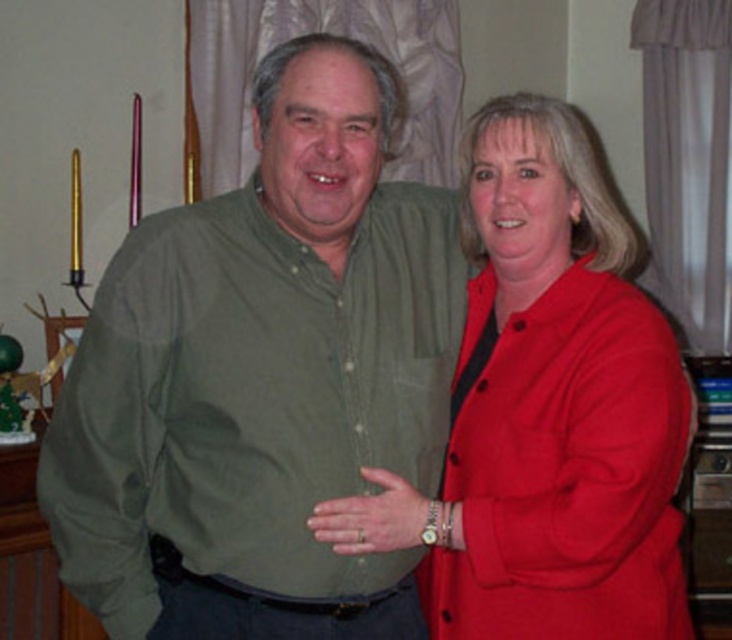
In the scene shown: Who is more distant from viewer, (326,68) or (507,138)?

The point (507,138) is more distant.

Does green cotton shirt at center have a smaller size compared to matte red blazer at center?

Indeed, green cotton shirt at center has a smaller size compared to matte red blazer at center.

Which is in front, point (395, 301) or point (583, 586)?

Positioned in front is point (583, 586).

The width and height of the screenshot is (732, 640). I want to click on green cotton shirt at center, so click(x=261, y=378).